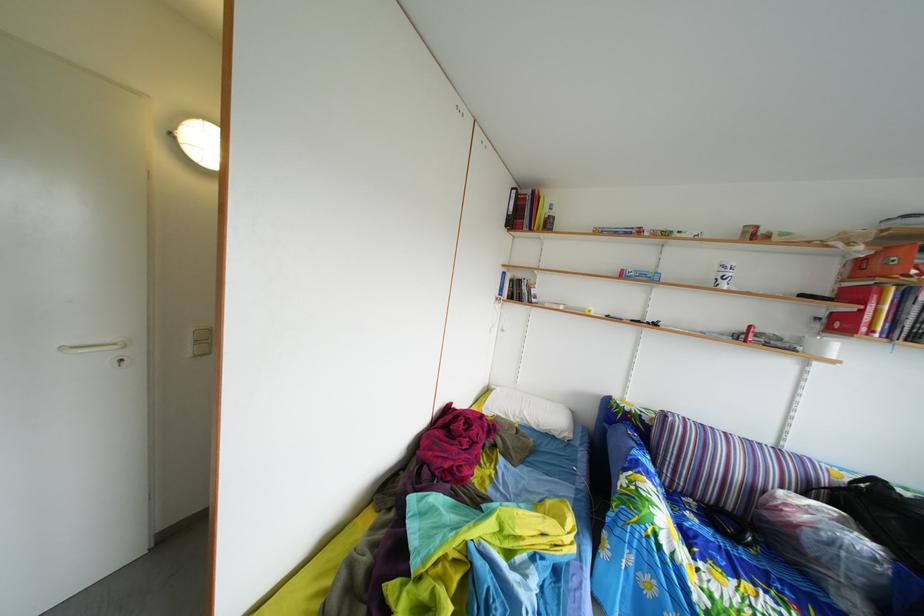
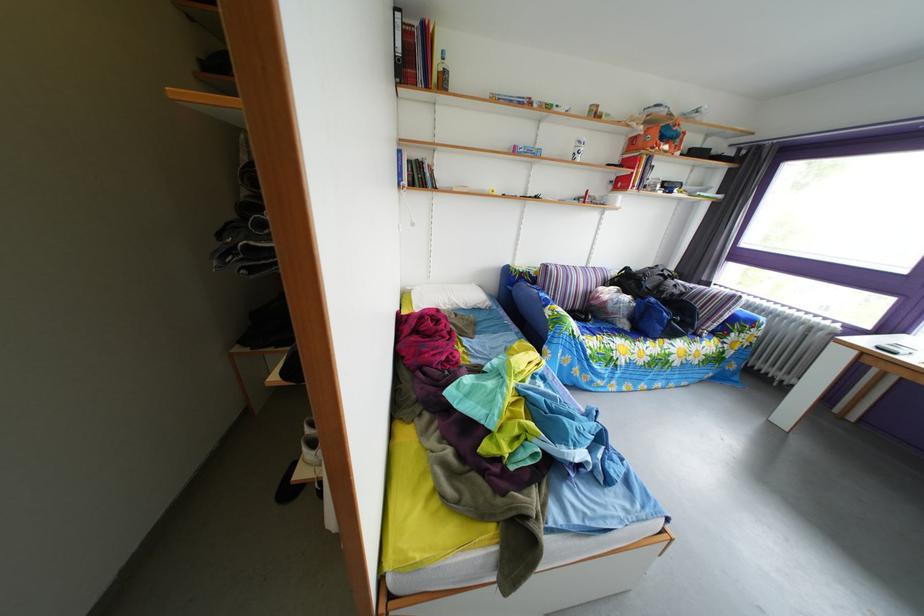
Where in the second image is the point corresponding to point (565, 429) from the first image?

(485, 305)